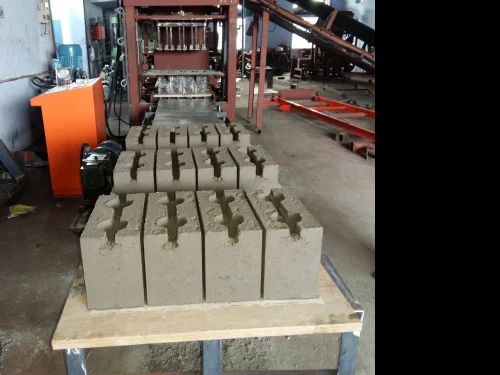
This screenshot has width=500, height=375. Find the location of `table legs`. table legs is located at coordinates (75, 358), (211, 346), (346, 347).